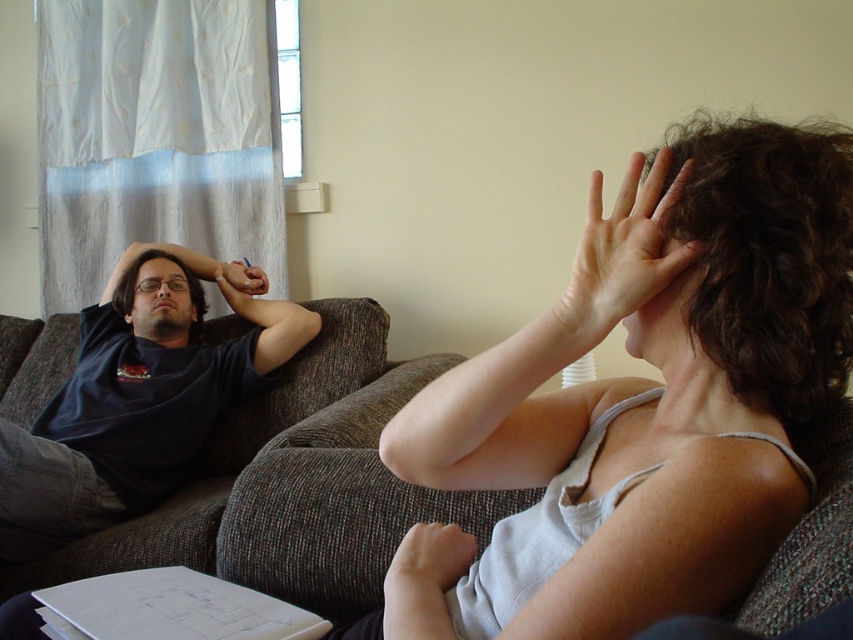
Question: Which is nearer to the matte skin hand at upper right?

Choices:
 (A) dark blue t-shirt at left
 (B) matte black head at left

Answer: (A)

Question: Which point is farther to the camera?

Choices:
 (A) (592, 282)
 (B) (187, 275)

Answer: (B)

Question: Does matte skin hand at upper right have a larger size compared to matte black head at left?

Choices:
 (A) yes
 (B) no

Answer: (B)

Question: Is dark blue t-shirt at left wider than matte skin hand at upper right?

Choices:
 (A) no
 (B) yes

Answer: (B)

Question: Estimate the real-world distances between objects in this image. Which object is farther from the matte skin hand at upper right?

Choices:
 (A) matte black head at left
 (B) dark blue t-shirt at left

Answer: (A)

Question: Can you confirm if matte skin hand at upper right is positioned below matte black head at left?

Choices:
 (A) no
 (B) yes

Answer: (B)